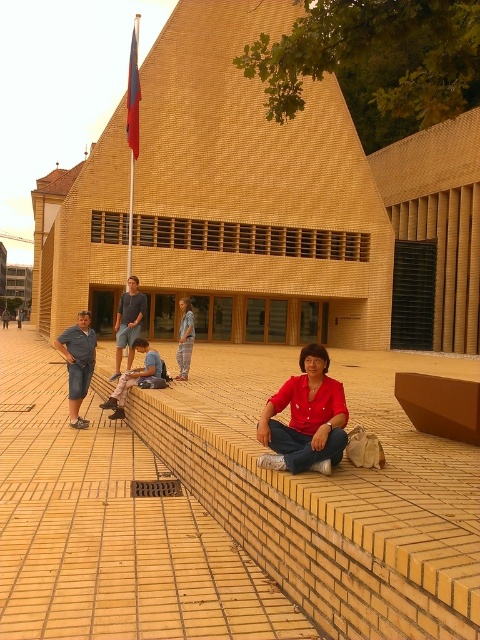
You are a photographer trying to capture a shot of the matte red blouse at center and the denim shorts at left. If you want to frame both subjects in your camera, which one should you zoom in on to ensure they both fit in the frame?

You should zoom in on the denim shorts at left because the matte red blouse at center might be wider than the denim shorts at left, so focusing on the wider subject would help both fit better in the frame.

You are a photographer taking a picture of the matte red blouse at center and denim shorts at center. Which object should you focus on first if you want to capture both in the same frame?

The matte red blouse at center is located below denim shorts at center, so you should focus on the denim shorts at center first to ensure both are in the frame.

You are standing in front of the modern building with the triangular roof. You see a person wearing a matte red blouse at center and another wearing denim shorts at left. From your perspective, which clothing item is positioned to the right?

The matte red blouse at center is positioned to the right of the denim shorts at left.